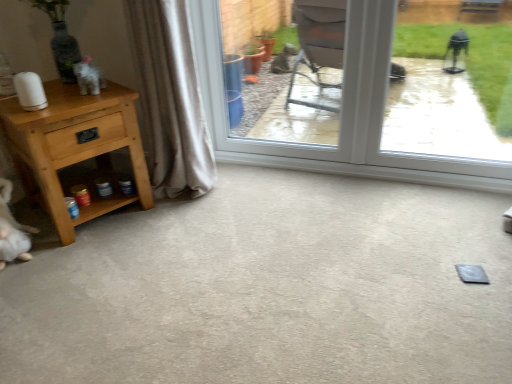
I want to click on beige fabric curtain at left, so [x=169, y=99].

Image resolution: width=512 pixels, height=384 pixels. What are the coordinates of `gray carpet at lower left` in the screenshot? It's located at (270, 289).

From a real-world perspective, between white glossy elephant at upper left and beige fabric curtain at left, who is vertically lower?

In real-world perspective, beige fabric curtain at left is lower.

Between white glossy elephant at upper left and beige fabric curtain at left, which one has larger width?

beige fabric curtain at left is wider.

Is white glossy elephant at upper left facing away from beige fabric curtain at left?

white glossy elephant at upper left is not turned away from beige fabric curtain at left.

What's the angular difference between white glossy elephant at upper left and beige fabric curtain at left's facing directions?

white glossy elephant at upper left and beige fabric curtain at left are facing 18.9 degrees away from each other.

Does light brown wood nightstand at left have a larger size compared to white glossy elephant at upper left?

Indeed, light brown wood nightstand at left has a larger size compared to white glossy elephant at upper left.

Based on the photo, looking at their sizes, would you say light brown wood nightstand at left is wider or thinner than white glossy elephant at upper left?

In the image, light brown wood nightstand at left appears to be wider than white glossy elephant at upper left.

Between light brown wood nightstand at left and white glossy elephant at upper left, which one is positioned behind?

white glossy elephant at upper left.

Can you tell me how much light brown wood nightstand at left and white glossy elephant at upper left differ in facing direction?

The facing directions of light brown wood nightstand at left and white glossy elephant at upper left are 40.8 degrees apart.

Considering the relative sizes of gray carpet at lower left and light brown wood nightstand at left in the image provided, is gray carpet at lower left bigger than light brown wood nightstand at left?

No, gray carpet at lower left is not bigger than light brown wood nightstand at left.

From the image's perspective, which is above, gray carpet at lower left or light brown wood nightstand at left?

light brown wood nightstand at left, from the image's perspective.

Is gray carpet at lower left far from light brown wood nightstand at left?

Actually, gray carpet at lower left and light brown wood nightstand at left are a little close together.

What's the angular difference between gray carpet at lower left and light brown wood nightstand at left's facing directions?

There is a 29-degree angle between the facing directions of gray carpet at lower left and light brown wood nightstand at left.

In terms of height, does beige fabric curtain at left look taller or shorter compared to light brown wood nightstand at left?

Clearly, beige fabric curtain at left is taller compared to light brown wood nightstand at left.

Is beige fabric curtain at left not close to light brown wood nightstand at left?

No, there isn't a large distance between beige fabric curtain at left and light brown wood nightstand at left.

From the image's perspective, is beige fabric curtain at left positioned above or below light brown wood nightstand at left?

Based on their image positions, beige fabric curtain at left is located above light brown wood nightstand at left.

Is beige fabric curtain at left oriented away from light brown wood nightstand at left?

That's not correct — beige fabric curtain at left is not looking away from light brown wood nightstand at left.

Can you confirm if light brown wood nightstand at left is thinner than transparent glass window at center?

Incorrect, the width of light brown wood nightstand at left is not less than that of transparent glass window at center.

Is there a large distance between light brown wood nightstand at left and transparent glass window at center?

No, light brown wood nightstand at left is not far from transparent glass window at center.

Which of these two, light brown wood nightstand at left or transparent glass window at center, is smaller?

transparent glass window at center.

Is light brown wood nightstand at left facing towards transparent glass window at center?

No, light brown wood nightstand at left is not turned towards transparent glass window at center.

Is light brown wood nightstand at left spatially inside beige fabric curtain at left, or outside of it?

light brown wood nightstand at left is spatially situated outside beige fabric curtain at left.

Does light brown wood nightstand at left have a greater width compared to beige fabric curtain at left?

Correct, the width of light brown wood nightstand at left exceeds that of beige fabric curtain at left.

Considering the sizes of light brown wood nightstand at left and beige fabric curtain at left in the image, is light brown wood nightstand at left bigger or smaller than beige fabric curtain at left?

light brown wood nightstand at left is bigger than beige fabric curtain at left.

Does light brown wood nightstand at left come in front of beige fabric curtain at left?

Yes, light brown wood nightstand at left is in front of beige fabric curtain at left.

Which of these two, transparent glass window at center or light brown wood nightstand at left, is wider?

With larger width is light brown wood nightstand at left.

Is transparent glass window at center facing away from light brown wood nightstand at left?

No.

Considering the positions of objects transparent glass window at center and light brown wood nightstand at left in the image provided, who is behind, transparent glass window at center or light brown wood nightstand at left?

transparent glass window at center.

The width and height of the screenshot is (512, 384). I want to click on window on the right of the light brown wood nightstand at left, so point(342,105).

At what (x,y) coordinates should I click in order to perform the action: click on animal on the left of beige fabric curtain at left. Please return your answer as a coordinate pair (x, y). Image resolution: width=512 pixels, height=384 pixels. Looking at the image, I should click on (89, 77).

This screenshot has height=384, width=512. In order to click on animal behind the light brown wood nightstand at left in this screenshot , I will do `click(89, 77)`.

Based on their spatial positions, is transparent glass window at center or gray carpet at lower left closer to light brown wood nightstand at left?

Among the two, gray carpet at lower left is located nearer to light brown wood nightstand at left.

Looking at the image, which one is located closer to white glossy elephant at upper left, beige fabric curtain at left or light brown wood nightstand at left?

light brown wood nightstand at left is closer to white glossy elephant at upper left.

Looking at the image, which one is located further to beige fabric curtain at left, light brown wood nightstand at left or transparent glass window at center?

transparent glass window at center is positioned further to the anchor beige fabric curtain at left.

In the scene shown: When comparing their distances from white glossy elephant at upper left, does beige fabric curtain at left or transparent glass window at center seem further?

transparent glass window at center is positioned further to the anchor white glossy elephant at upper left.

Estimate the real-world distances between objects in this image. Which object is closer to beige fabric curtain at left, gray carpet at lower left or transparent glass window at center?

Based on the image, transparent glass window at center appears to be nearer to beige fabric curtain at left.

In the scene shown: Looking at the image, which one is located further to white glossy elephant at upper left, transparent glass window at center or gray carpet at lower left?

gray carpet at lower left is further to white glossy elephant at upper left.

When comparing their distances from gray carpet at lower left, does beige fabric curtain at left or light brown wood nightstand at left seem closer?

Among the two, light brown wood nightstand at left is located nearer to gray carpet at lower left.

Estimate the real-world distances between objects in this image. Which object is further from light brown wood nightstand at left, gray carpet at lower left or white glossy elephant at upper left?

Based on the image, gray carpet at lower left appears to be further to light brown wood nightstand at left.

At what (x,y) coordinates should I click in order to perform the action: click on nightstand between gray carpet at lower left and white glossy elephant at upper left along the z-axis. Please return your answer as a coordinate pair (x, y). Looking at the image, I should click on (75, 148).

Where is `animal between light brown wood nightstand at left and transparent glass window at center from left to right`? The height and width of the screenshot is (384, 512). animal between light brown wood nightstand at left and transparent glass window at center from left to right is located at coordinates (89, 77).

Where is `curtain between light brown wood nightstand at left and transparent glass window at center from left to right`? curtain between light brown wood nightstand at left and transparent glass window at center from left to right is located at coordinates (169, 99).

Locate an element on the screen. curtain between gray carpet at lower left and white glossy elephant at upper left along the z-axis is located at coordinates (169, 99).